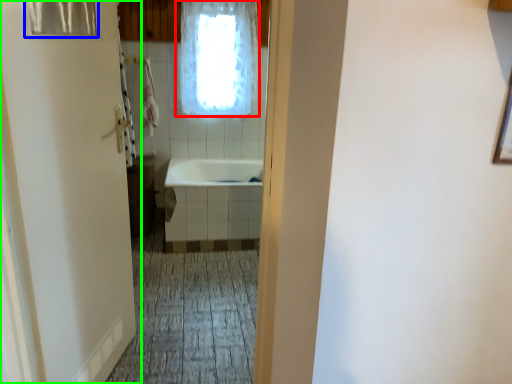
Question: Estimate the real-world distances between objects in this image. Which object is closer to window (highlighted by a red box), shower curtain (highlighted by a blue box) or door (highlighted by a green box)?

Choices:
 (A) shower curtain
 (B) door

Answer: (B)